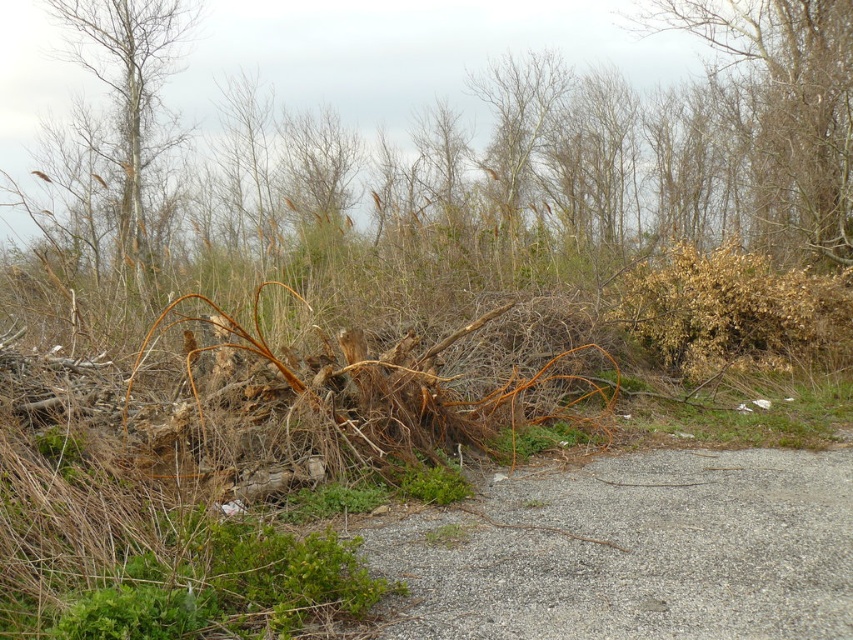
You are a hiker trying to navigate the terrain. You see the gray gravel path at center and the brown dry bush at right. Which direction should you go to stay on the path and avoid the bush?

The gray gravel path at center is to the left of the brown dry bush at right, so you should go left to stay on the path and avoid the bush.

You are a hiker carrying a 5 meter long rope. You want to secure both the brown dry branches at upper right and the brown dry bush at right. Can you tie them together with the rope without stretching it?

The distance between the brown dry branches at upper right and the brown dry bush at right is 4.67 meters. Since the rope is 5 meters long, it is possible to tie them together without stretching the rope.

You are a hiker who wants to take a photo of both the brown dry branches at upper right and the bare wood tree at upper left. Which object should you focus on first if you want to capture both in a single frame without moving your camera?

You should focus on the bare wood tree at upper left first because it is taller than the brown dry branches at upper right, allowing both to fit in the frame when centered on the taller object.